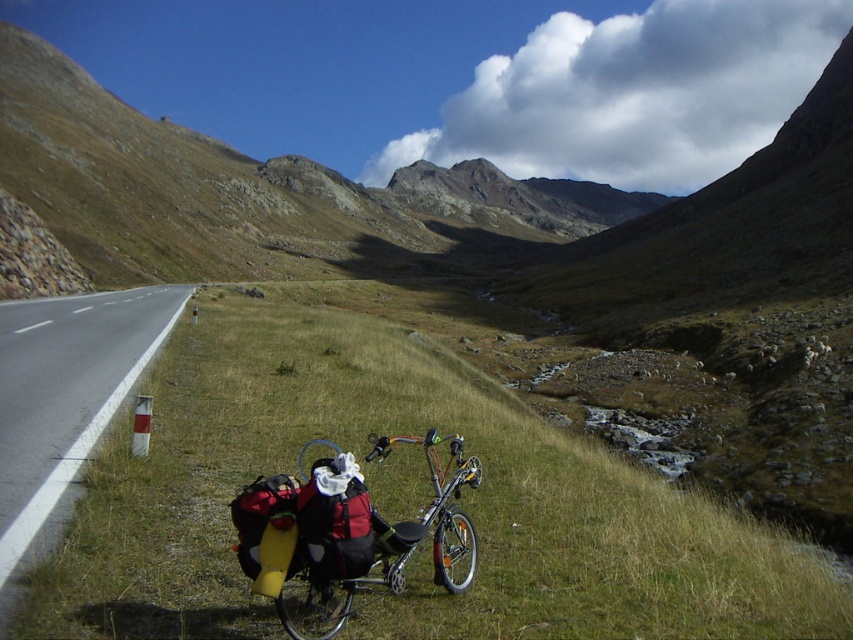
What do you see at coordinates (221, 193) in the screenshot?
I see `rugged stone mountain at center` at bounding box center [221, 193].

Does point (555, 221) come farther from viewer compared to point (444, 488)?

Yes, it is.

Measure the distance between rugged stone mountain at center and camera.

rugged stone mountain at center is 41.06 meters from camera.

At what (x,y) coordinates should I click in order to perform the action: click on rugged stone mountain at center. Please return your answer as a coordinate pair (x, y). The width and height of the screenshot is (853, 640). Looking at the image, I should click on (221, 193).

Is point (24, 64) positioned behind point (4, 460)?

Yes, it is.

Which is behind, point (433, 209) or point (22, 376)?

The point (433, 209) is behind.

Where is `rugged stone mountain at center`? This screenshot has width=853, height=640. rugged stone mountain at center is located at coordinates (221, 193).

Which of these two, white asphalt road at lower left or shiny metallic bicycle at lower center, stands taller?

With more height is white asphalt road at lower left.

Between white asphalt road at lower left and shiny metallic bicycle at lower center, which one appears on the left side from the viewer's perspective?

Positioned to the left is white asphalt road at lower left.

This screenshot has height=640, width=853. What are the coordinates of `white asphalt road at lower left` in the screenshot? It's located at (64, 403).

Where is `white asphalt road at lower left`? This screenshot has height=640, width=853. white asphalt road at lower left is located at coordinates (64, 403).